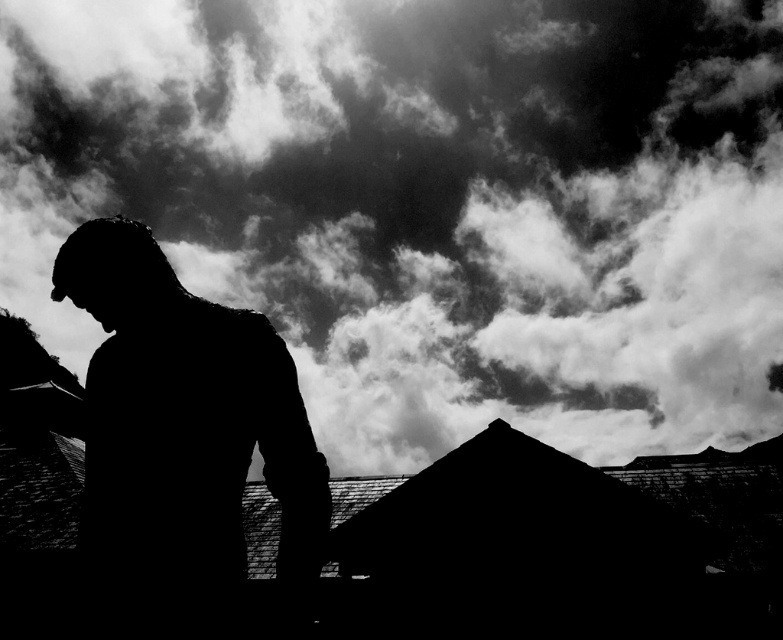
Question: Does cloudy sky at upper center come behind black matte statue at center?

Choices:
 (A) yes
 (B) no

Answer: (A)

Question: Does cloudy sky at upper center have a greater width compared to black matte statue at center?

Choices:
 (A) no
 (B) yes

Answer: (B)

Question: Which of the following is the closest to the observer?

Choices:
 (A) cloudy sky at upper center
 (B) black matte statue at center

Answer: (B)

Question: Does cloudy sky at upper center have a larger size compared to black matte statue at center?

Choices:
 (A) yes
 (B) no

Answer: (A)

Question: Which point is farther to the camera?

Choices:
 (A) black matte statue at center
 (B) cloudy sky at upper center

Answer: (B)